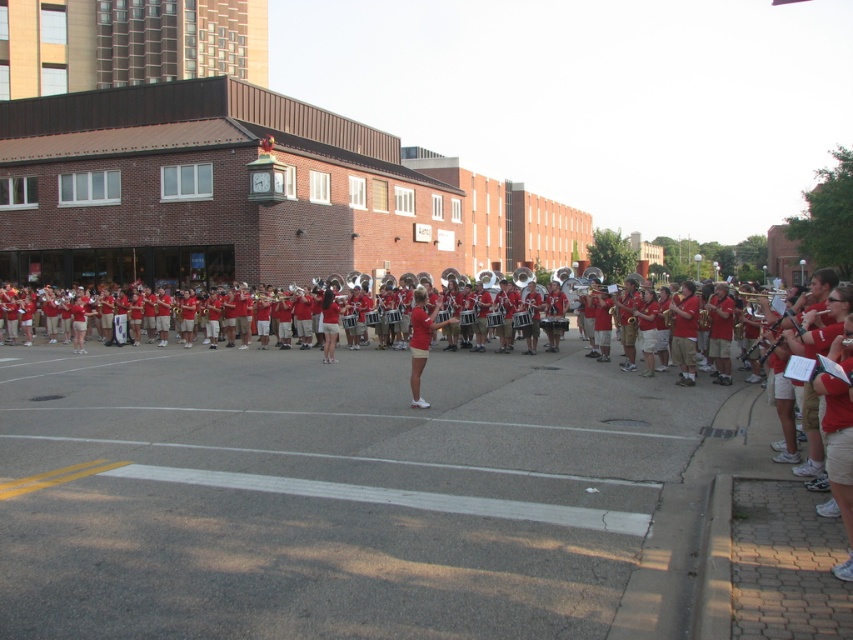
Does red smooth uniform at center appear over matte red uniform at center?

No, red smooth uniform at center is not above matte red uniform at center.

Who is more forward, [308,570] or [437,301]?

Point [308,570]

This screenshot has width=853, height=640. What are the coordinates of `red smooth uniform at center` in the screenshot? It's located at (373, 486).

Between point (57, 524) and point (836, 340), which one is positioned in front?

Point (836, 340) is in front.

Does point (558, 378) come in front of point (834, 388)?

That is False.

What do you see at coordinates (373, 486) in the screenshot?
I see `red smooth uniform at center` at bounding box center [373, 486].

The width and height of the screenshot is (853, 640). Find the location of `red smooth uniform at center`. red smooth uniform at center is located at coordinates (373, 486).

Between point (648, 384) and point (338, 304), which one is positioned in front?

Point (648, 384)

Does red smooth uniform at center have a smaller size compared to matte red shorts at center?

Actually, red smooth uniform at center might be larger than matte red shorts at center.

Image resolution: width=853 pixels, height=640 pixels. What do you see at coordinates (373, 486) in the screenshot? I see `red smooth uniform at center` at bounding box center [373, 486].

Where is `red smooth uniform at center`? red smooth uniform at center is located at coordinates (373, 486).